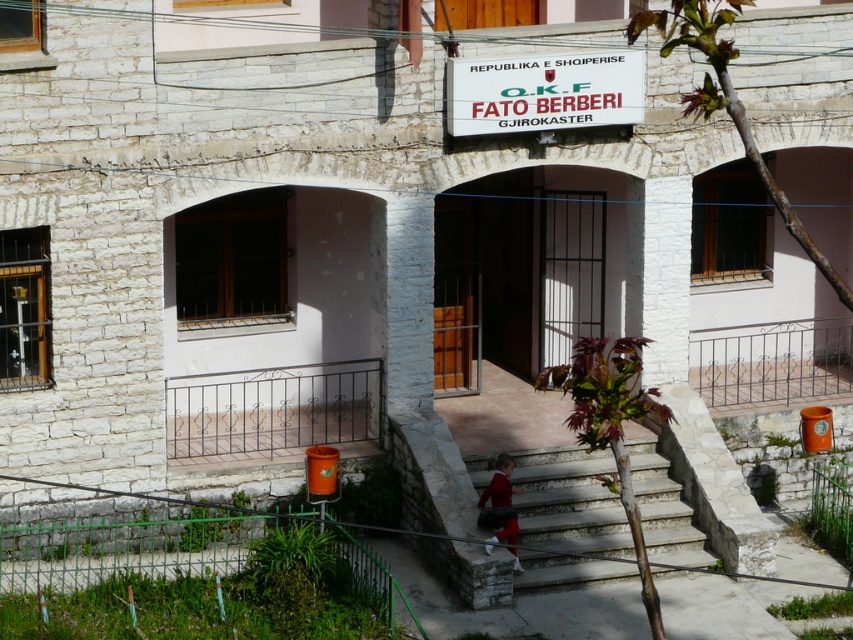
You are a tour guide leading a group to the entrance of the building. The group needs to know the distance between the white stone stairs at center and the white plastic sign at upper center. Can you provide this information?

The white stone stairs at center is 3.92 meters from the white plastic sign at upper center, so the distance between them is 3.92 meters.

You are standing at the entrance of the stone building and see two points marked on the ground. The first point is at coordinates point (541, 582) and the second point is at point (587, 122). Which point is closer to you?

Point (541, 582) is in front of point (587, 122), so it is closer to you.

You are planning to deliver a package to the building shown. The stairs must be higher than the sign to ensure the delivery drone can navigate safely. Does the white stone stairs at center meet this requirement compared to the white plastic sign at upper center?

The white stone stairs at center has a greater height compared to the white plastic sign at upper center, so yes, the stairs meet the requirement of being higher than the sign for safe drone navigation.